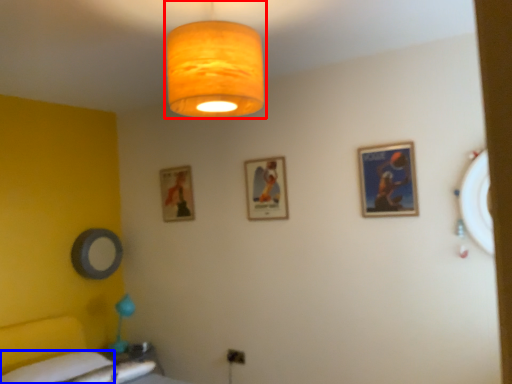
Question: Which point is further to the camera, lamp (highlighted by a red box) or sheet (highlighted by a blue box)?

Choices:
 (A) lamp
 (B) sheet

Answer: (B)